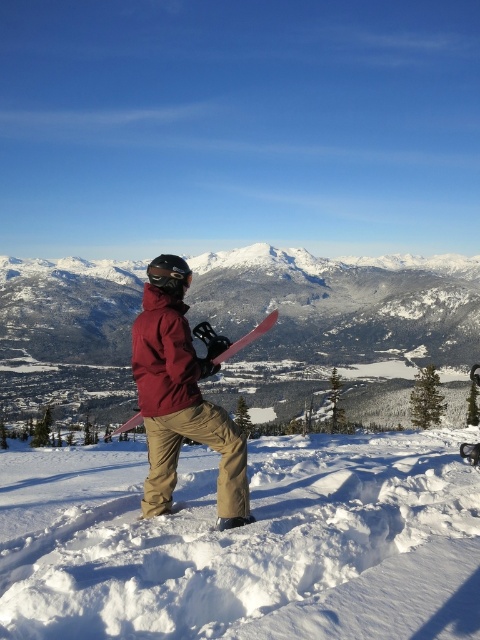
You are a photographer positioned at the edge of the snowy slope. You want to capture a photo of the white fluffy snow at center and the black matte goggles at center. Which object should you adjust your camera focus to first if you want to ensure both are in focus, considering their positions?

The white fluffy snow at center is to the right of the black matte goggles at center. To ensure both are in focus, adjust the camera focus starting with the closer object. However, since both are at the same center position but offset left and right, using a smaller aperture or focusing on the midpoint between them would be more effective.

You are a drone operator tasked with capturing aerial footage of the person in the scene. Your drone has a maximum range of 10 meters. If you are positioned at the starting point, can you fly the drone from the matte red jacket at center to the black matte goggles at center without exceeding the drone range limit?

The matte red jacket at center and black matte goggles at center are 10.10 meters apart from each other. Since the drone has a maximum range of 10 meters, it cannot reach the black matte goggles at center from the matte red jacket at center without exceeding its limit.

You are a snowboarder standing at the base of the snowy white mountain at center. You want to reach the summit. If your snowboard can travel 100 meters per minute, how long will it take you to reach the summit?

The distance between the snowy white mountain at center and the viewer is 266.81 meters. Since the snowboard can travel 100 meters per minute, it would take approximately 2.6681 minutes, which is roughly 2 minutes and 40 seconds, to reach the summit.